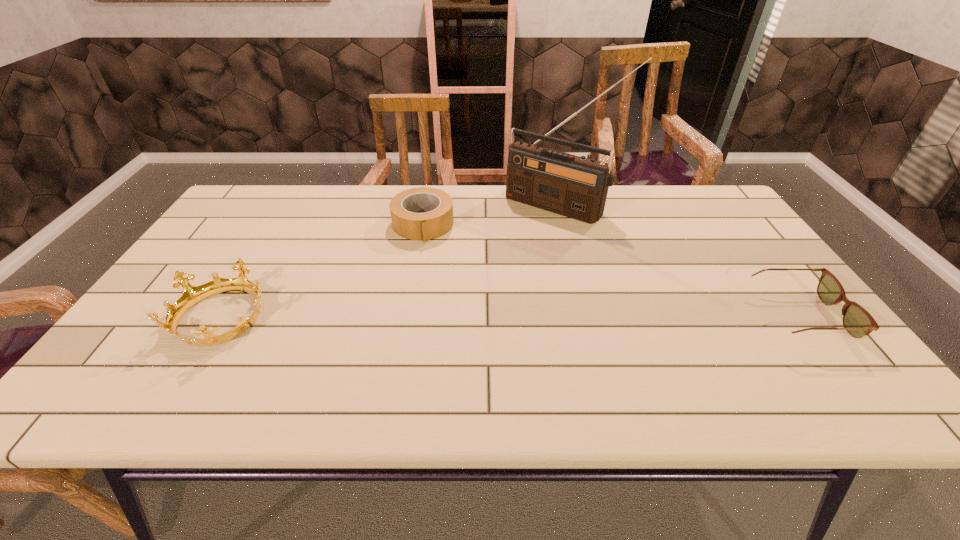
At what (x,y) coordinates should I click in order to perform the action: click on vacant area between the third object from left to right and the third shortest object. Please return your answer as a coordinate pair (x, y). This screenshot has width=960, height=540. Looking at the image, I should click on (391, 261).

Find the location of `empty space between the rightmost object and the crown`. empty space between the rightmost object and the crown is located at coordinates (511, 316).

At what (x,y) coordinates should I click in order to perform the action: click on free space between the crown and the radio receiver. Please return your answer as a coordinate pair (x, y). Looking at the image, I should click on pos(391,261).

This screenshot has height=540, width=960. What are the coordinates of `free space between the rightmost object and the duct tape` in the screenshot? It's located at (611, 270).

Where is `vacant area that lies between the leftmost object and the third object from right to left`? The height and width of the screenshot is (540, 960). vacant area that lies between the leftmost object and the third object from right to left is located at coordinates (323, 270).

Where is `vacant space that's between the rightmost object and the third object from right to left`? vacant space that's between the rightmost object and the third object from right to left is located at coordinates (611, 270).

Where is `the third closest object to the second object from left to right`? Image resolution: width=960 pixels, height=540 pixels. the third closest object to the second object from left to right is located at coordinates (857, 321).

Identify which object is located as the nearest to the radio receiver. Please provide its 2D coordinates. Your answer should be formatted as a tuple, i.e. [(x, y)], where the tuple contains the x and y coordinates of a point satisfying the conditions above.

[(423, 213)]

You are a GUI agent. You are given a task and a screenshot of the screen. Output one action in this format:
    pyautogui.click(x=<x>, y=<y>)
    Task: Click on the free spot that satisfies the following two spatial constraints: 1. on the back side of the leftmost object; 2. on the left side of the second object from left to right
    
    Given the screenshot: What is the action you would take?
    pyautogui.click(x=279, y=224)

Identify the location of vacant space that satisfies the following two spatial constraints: 1. on the back side of the crown; 2. on the right side of the second object from left to right. click(x=279, y=224).